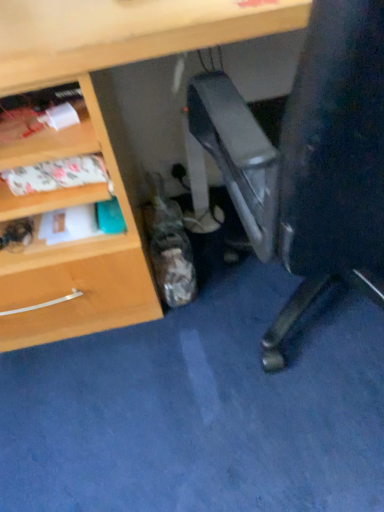
What are the coordinates of `white glossy paper at upper left` in the screenshot? It's located at (46, 127).

The image size is (384, 512). What do you see at coordinates (46, 127) in the screenshot? I see `white glossy paper at upper left` at bounding box center [46, 127].

Where is `white glossy paper at upper left`? This screenshot has width=384, height=512. white glossy paper at upper left is located at coordinates (46, 127).